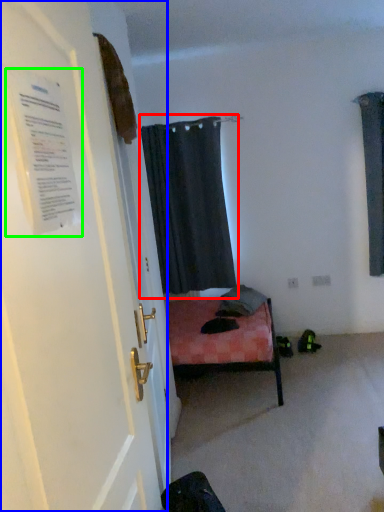
Question: Considering the real-world distances, which object is farthest from curtain (highlighted by a red box)? door (highlighted by a blue box) or poster (highlighted by a green box)?

Choices:
 (A) door
 (B) poster

Answer: (B)